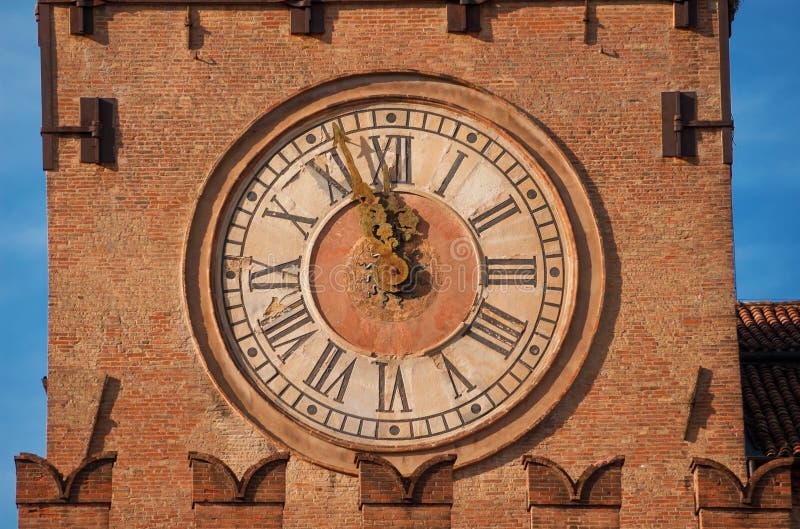
I want to click on exposed red brick, so click(x=145, y=412).